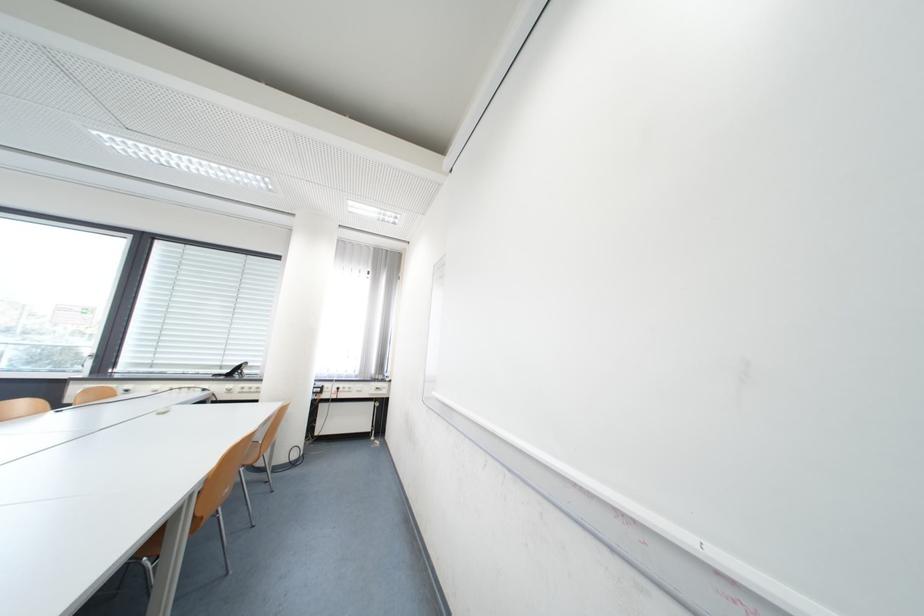
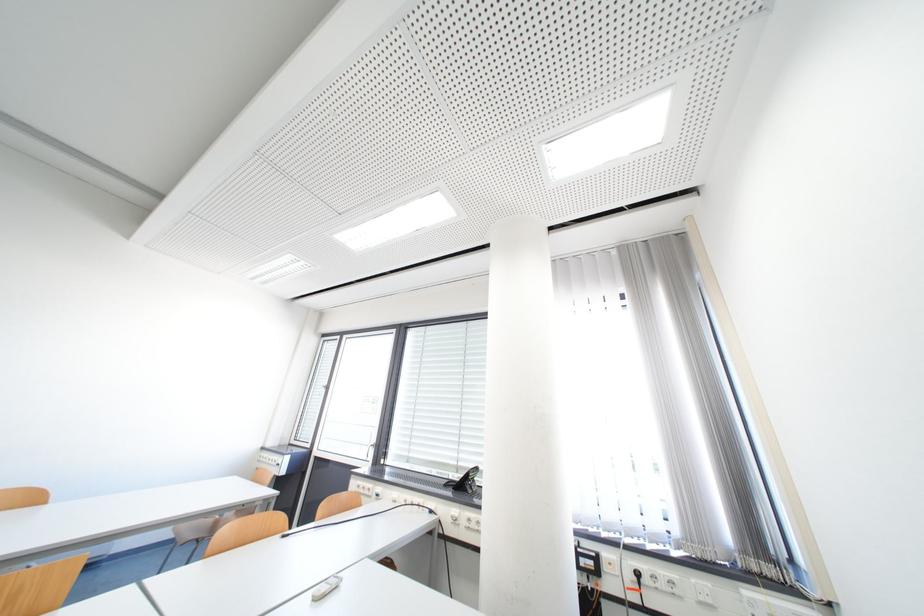
Where in the second image is the point corresponding to (345,391) from the first image?

(639, 578)